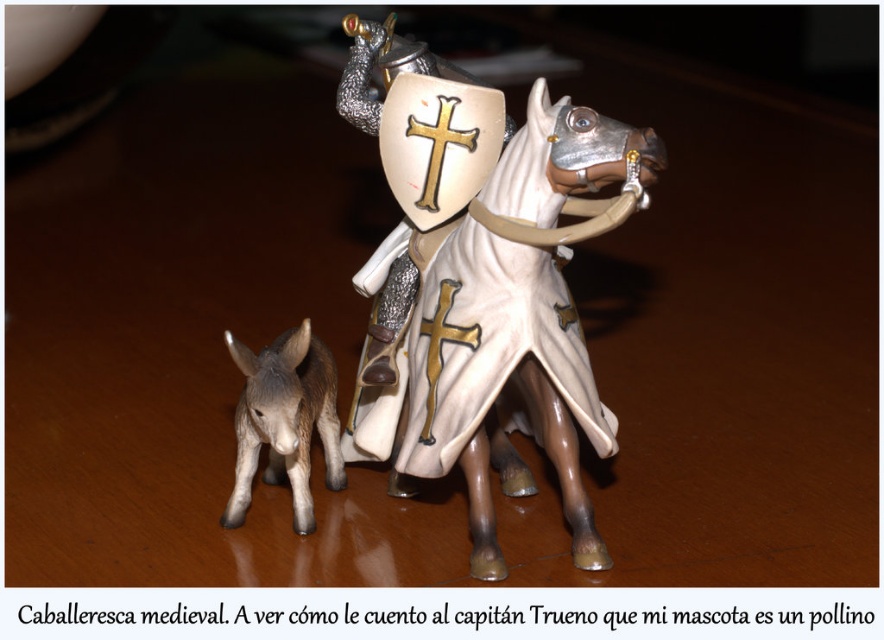
You are a medieval knight standing behind the white glossy plastic horse at center. You need to reach the brown matte donkey at lower left to retrieve your lost coin. Can you directly see the donkey without moving around the horse?

The white glossy plastic horse at center is in front of the brown matte donkey at lower left, so the knight cannot directly see the donkey without moving around the horse.

You are a medieval toy collector who wants to display both the white glossy plastic horse at center and the brown matte donkey at lower left on a shelf. Which toy should you place on the lower shelf to ensure it doesn

The brown matte donkey at lower left should be placed on the lower shelf because it is shorter than the white glossy plastic horse at center.

You are a toy collector who wants to place the white glossy plastic horse at center and the brown matte donkey at lower left on a shelf. The shelf has a maximum length of 20 centimeters. Can both toys fit side by side on the shelf without overlapping?

The white glossy plastic horse at center is 18.96 centimeters away from the brown matte donkey at lower left, so there is enough space between them to fit both on the shelf since the total required space would be slightly less than 20 centimeters.